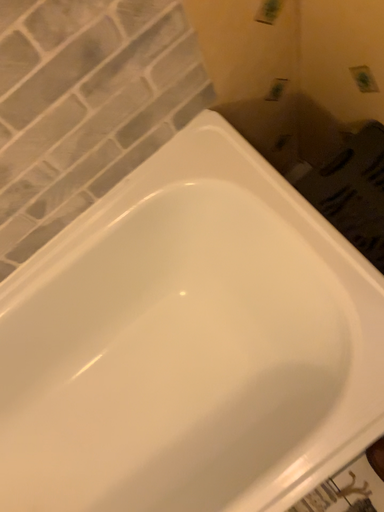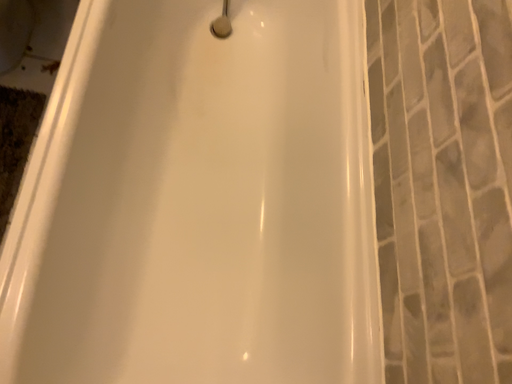
Question: How did the camera likely rotate when shooting the video?

Choices:
 (A) rotated right
 (B) rotated left

Answer: (B)